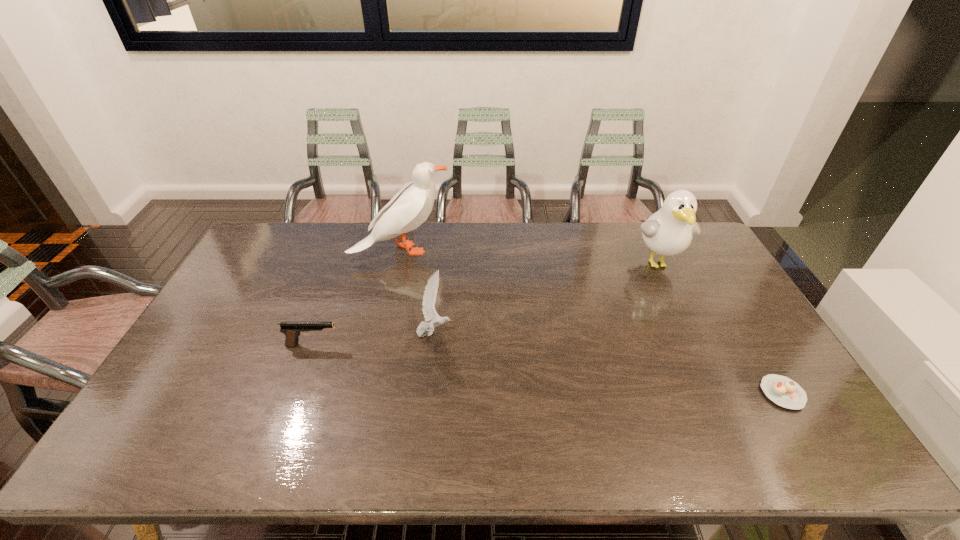
Identify which gull is located as the nearest to the rightmost gull. Please provide its 2D coordinates. Your answer should be formatted as a tuple, i.e. [(x, y)], where the tuple contains the x and y coordinates of a point satisfying the conditions above.

[(429, 298)]

The height and width of the screenshot is (540, 960). In order to click on vacant space that satisfies the following two spatial constraints: 1. on the beak of the rightmost gull; 2. at the tip of the beak of the third shortest object in this screenshot , I will do `click(692, 333)`.

You are a GUI agent. You are given a task and a screenshot of the screen. Output one action in this format:
    pyautogui.click(x=<x>, y=<y>)
    Task: Click on the free spot that satisfies the following two spatial constraints: 1. on the beak of the cupcake; 2. on the right side of the fourth object from left to right
    The image size is (960, 540).
    Given the screenshot: What is the action you would take?
    pyautogui.click(x=721, y=393)

At what (x,y) coordinates should I click in order to perform the action: click on vacant area in the image that satisfies the following two spatial constraints: 1. at the tip of the beak of the third tallest object; 2. on the back side of the shortest object. Please return your answer as a coordinate pair (x, y). Image resolution: width=960 pixels, height=540 pixels. Looking at the image, I should click on (428, 393).

This screenshot has width=960, height=540. I want to click on vacant space that satisfies the following two spatial constraints: 1. on the beak of the second object from right to left; 2. at the muzzle of the second shortest object, so click(x=698, y=345).

This screenshot has width=960, height=540. Identify the location of free location that satisfies the following two spatial constraints: 1. on the beak of the rightmost gull; 2. at the tip of the beak of the nearest gull. tap(692, 333).